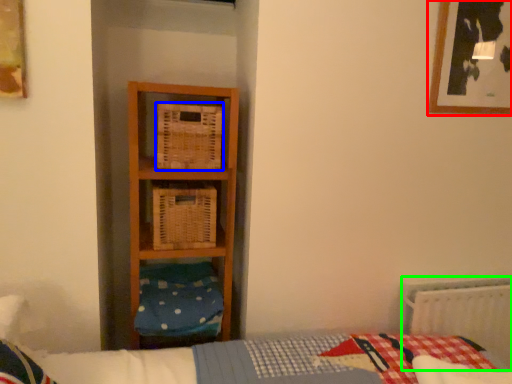
Question: Which object is positioned closest to picture frame (highlighted by a red box)? Select from crate (highlighted by a blue box) and radiator (highlighted by a green box).

Choices:
 (A) crate
 (B) radiator

Answer: (B)